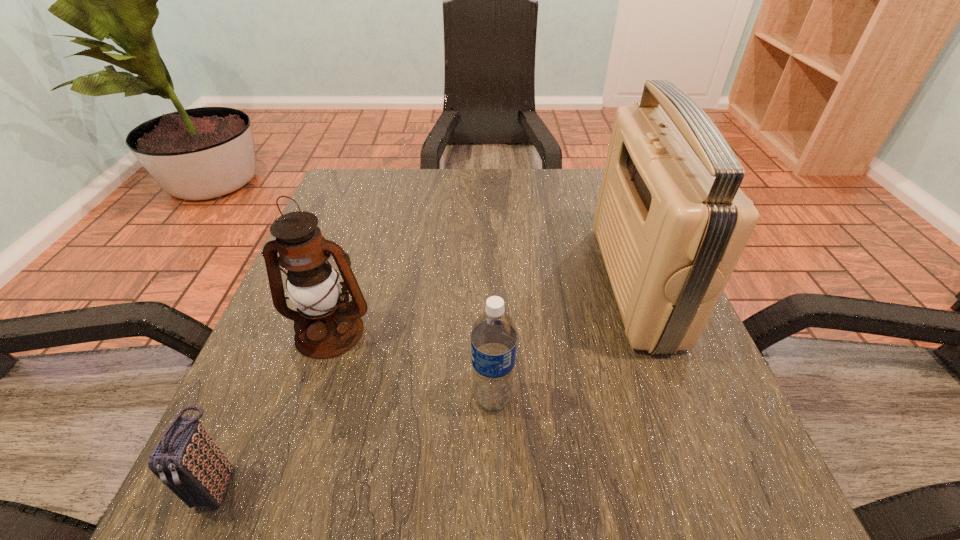
I want to click on radio receiver, so click(671, 222).

Identify the location of the tallest object. [671, 222].

Identify the location of lantern. This screenshot has height=540, width=960. (313, 286).

Find the location of a particular element. the second nearest object is located at coordinates (494, 336).

This screenshot has width=960, height=540. In order to click on water bottle in this screenshot , I will do `click(494, 336)`.

This screenshot has width=960, height=540. What are the coordinates of `the nearest object` in the screenshot? It's located at (186, 459).

I want to click on clutch bag, so coord(186,459).

I want to click on free spot located on the front-facing side of the rightmost object, so click(x=539, y=282).

Locate an element on the screen. The height and width of the screenshot is (540, 960). free space located 0.390m on the front-facing side of the rightmost object is located at coordinates (406, 282).

At what (x,y) coordinates should I click in order to perform the action: click on free space located 0.080m on the front-facing side of the rightmost object. Please return your answer as a coordinate pair (x, y). The height and width of the screenshot is (540, 960). Looking at the image, I should click on (564, 282).